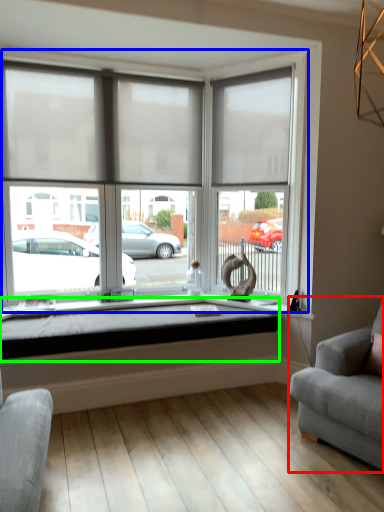
Question: Which object is positioned closest to studio couch (highlighted by a red box)? Select from window (highlighted by a blue box) and window sill (highlighted by a green box).

Choices:
 (A) window
 (B) window sill

Answer: (B)